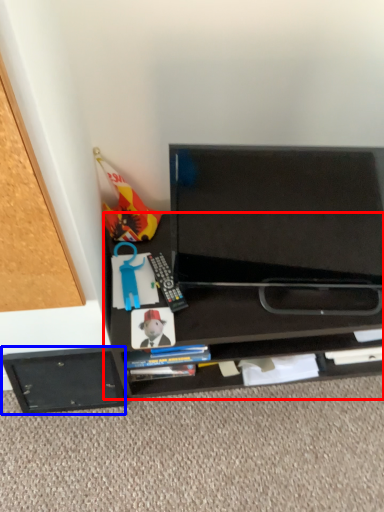
Question: Which of the following is the farthest to the observer, desk (highlighted by a red box) or drawer (highlighted by a blue box)?

Choices:
 (A) desk
 (B) drawer

Answer: (B)